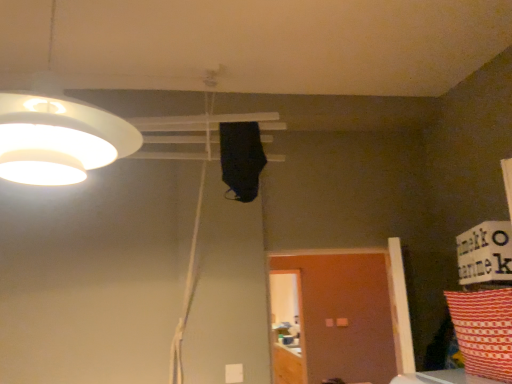
Question: Is brown matte door at lower right further to camera compared to red and white patterned pillow at lower right?

Choices:
 (A) yes
 (B) no

Answer: (A)

Question: Is the surface of brown matte door at lower right in direct contact with red and white patterned pillow at lower right?

Choices:
 (A) yes
 (B) no

Answer: (B)

Question: Is the position of brown matte door at lower right less distant than that of red and white patterned pillow at lower right?

Choices:
 (A) no
 (B) yes

Answer: (A)

Question: Are brown matte door at lower right and red and white patterned pillow at lower right located far from each other?

Choices:
 (A) no
 (B) yes

Answer: (B)

Question: Could you tell me if brown matte door at lower right is facing red and white patterned pillow at lower right?

Choices:
 (A) no
 (B) yes

Answer: (B)

Question: Is brown matte door at lower right inside the boundaries of white matte lampshade at upper left, or outside?

Choices:
 (A) outside
 (B) inside

Answer: (A)

Question: Looking at their shapes, would you say brown matte door at lower right is wider or thinner than white matte lampshade at upper left?

Choices:
 (A) thin
 (B) wide

Answer: (A)

Question: In the image, is brown matte door at lower right on the left side or the right side of white matte lampshade at upper left?

Choices:
 (A) left
 (B) right

Answer: (B)

Question: Does point (321, 352) appear closer or farther from the camera than point (15, 165)?

Choices:
 (A) closer
 (B) farther

Answer: (B)

Question: From the image's perspective, is red and white patterned pillow at lower right located above or below white matte lampshade at upper left?

Choices:
 (A) below
 (B) above

Answer: (A)

Question: From a real-world perspective, is red and white patterned pillow at lower right physically located above or below white matte lampshade at upper left?

Choices:
 (A) below
 (B) above

Answer: (A)

Question: Do you think red and white patterned pillow at lower right is within white matte lampshade at upper left, or outside of it?

Choices:
 (A) inside
 (B) outside

Answer: (B)

Question: Is red and white patterned pillow at lower right taller or shorter than white matte lampshade at upper left?

Choices:
 (A) tall
 (B) short

Answer: (B)

Question: Is red and white patterned pillow at lower right bigger or smaller than brown matte door at lower right?

Choices:
 (A) big
 (B) small

Answer: (B)

Question: From the image's perspective, is red and white patterned pillow at lower right located above or below brown matte door at lower right?

Choices:
 (A) above
 (B) below

Answer: (A)